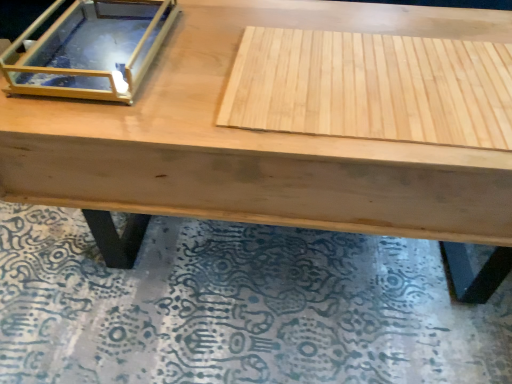
Question: Is clear glass box at upper left in front of or behind wooden mat at lower center in the image?

Choices:
 (A) front
 (B) behind

Answer: (A)

Question: In terms of width, does clear glass box at upper left look wider or thinner when compared to wooden mat at lower center?

Choices:
 (A) thin
 (B) wide

Answer: (A)

Question: Which object is positioned closest to the wooden mat at lower center?

Choices:
 (A) clear glass box at upper left
 (B) natural wood plywood at center

Answer: (B)

Question: Which object is positioned closest to the wooden mat at lower center?

Choices:
 (A) natural wood plywood at center
 (B) clear glass box at upper left

Answer: (A)